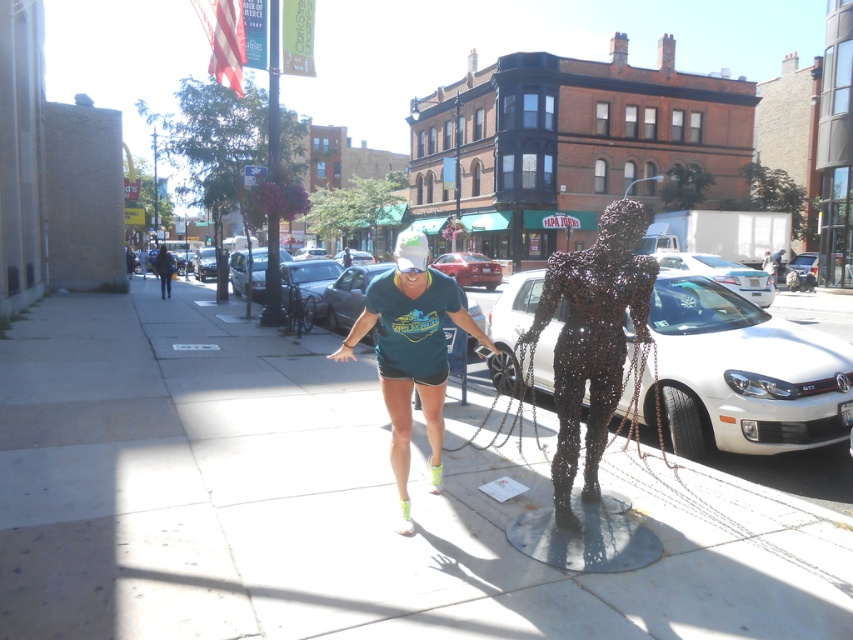
Question: Observing the image, what is the correct spatial positioning of gray concrete sidewalk at center in reference to white glossy car at center?

Choices:
 (A) above
 (B) below

Answer: (B)

Question: Does gray concrete sidewalk at center have a lesser width compared to green matte t-shirt at center?

Choices:
 (A) no
 (B) yes

Answer: (A)

Question: Which is farther from the shiny metallic sculpture at center?

Choices:
 (A) green matte t-shirt at center
 (B) metallic red car at center
 (C) white metallic car at center
 (D) gray concrete sidewalk at center

Answer: (B)

Question: Can you confirm if white metallic car at center is smaller than green matte t-shirt at center?

Choices:
 (A) no
 (B) yes

Answer: (B)

Question: Based on their relative distances, which object is nearer to the white metallic car at center?

Choices:
 (A) white glossy car at center
 (B) gray concrete sidewalk at center
 (C) metallic red car at center
 (D) shiny metallic sculpture at center

Answer: (D)

Question: Which object is closer to the camera taking this photo?

Choices:
 (A) green matte t-shirt at center
 (B) white glossy car at center

Answer: (A)